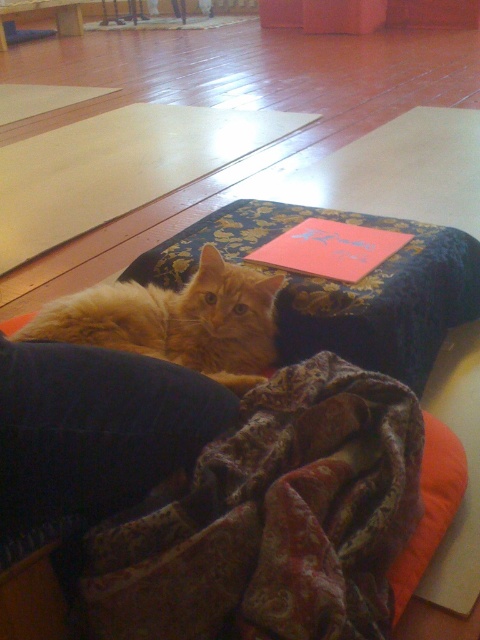
You are a pet sitter and need to place a small water bowl for the cat. The bowl requires 10 cm of space in front of the cat. Is there enough space in front of the fluffy orange cat at center considering the blue floral fabric yoga mat at center is taller than it?

The blue floral fabric yoga mat at center is taller than the fluffy orange cat at center. Since the yoga mat is taller, there is sufficient vertical space in front of the cat to place the water bowl, but the horizontal space requirement of 10 cm isn

You are a robotic vacuum trying to navigate from the blue floral fabric yoga mat at center to the orange fabric pillow at lower right. What is the shortest distance you need to travel in inches?

The shortest distance between the blue floral fabric yoga mat at center and the orange fabric pillow at lower right is 20.59 inches.

You are standing in the room and see two points marked in the scene. Which point, point (315, 609) or point (464, 232), is closer to you?

Point (315, 609) is closer to the viewer than point (464, 232).